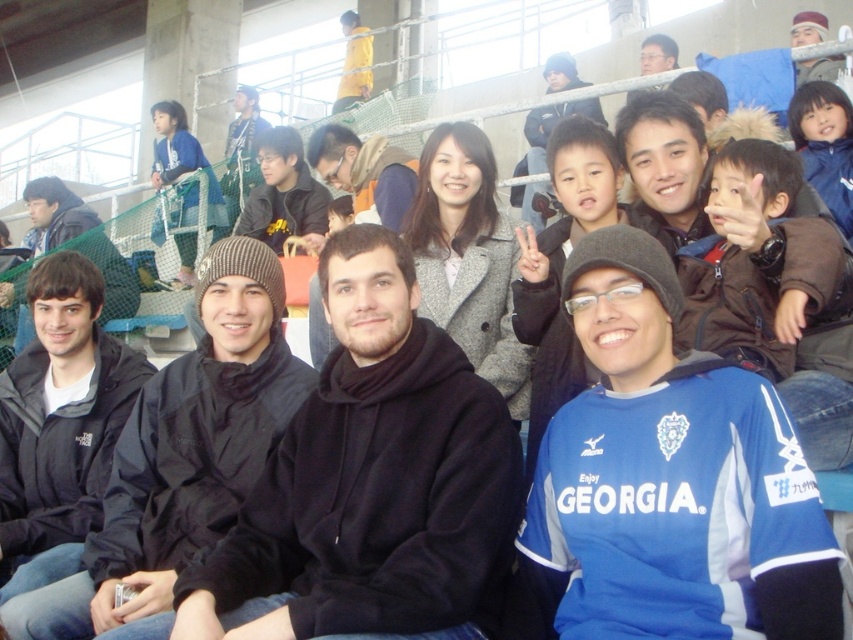
Question: Is black fleece hoodie at center thinner than dark blue jacket at left?

Choices:
 (A) no
 (B) yes

Answer: (A)

Question: Which is farther from the black fleece hoodie at center?

Choices:
 (A) matte black beanie at upper center
 (B) matte black jacket at center

Answer: (A)

Question: Which of the following is the farthest from the observer?

Choices:
 (A) (349, 513)
 (B) (245, 248)

Answer: (B)

Question: Does dark blue jacket at left appear on the right side of matte black beanie at upper center?

Choices:
 (A) yes
 (B) no

Answer: (B)

Question: Is blue jersey at center smaller than brown knit cap at center?

Choices:
 (A) yes
 (B) no

Answer: (B)

Question: Among these objects, which one is farthest from the camera?

Choices:
 (A) brown knit cap at center
 (B) matte black jacket at center
 (C) matte black beanie at upper center
 (D) dark blue jacket at left

Answer: (C)